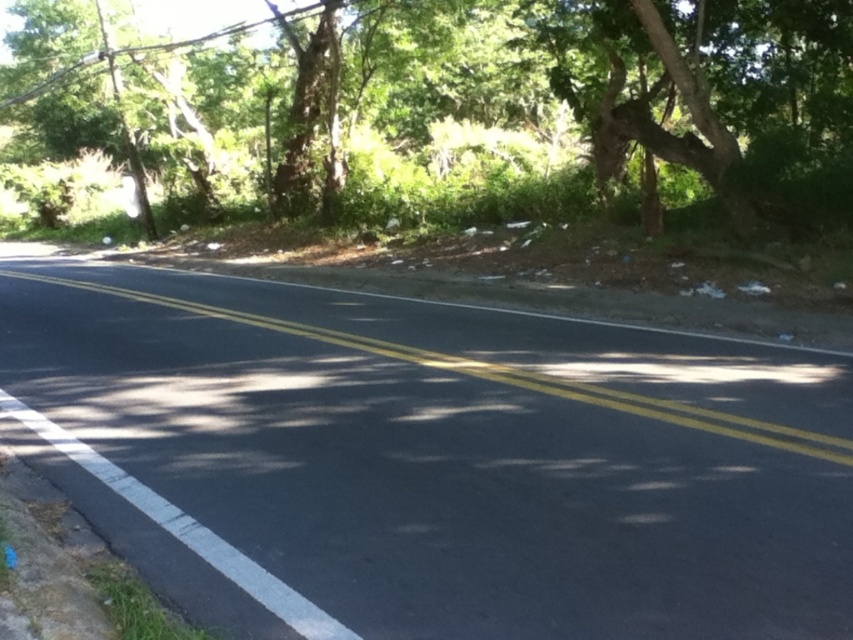
Question: Does black asphalt road at center appear over green leafy tree at upper center?

Choices:
 (A) yes
 (B) no

Answer: (B)

Question: In this image, where is black asphalt road at center located relative to green leafy tree at upper center?

Choices:
 (A) below
 (B) above

Answer: (A)

Question: In this image, where is black asphalt road at center located relative to green leafy tree at upper center?

Choices:
 (A) right
 (B) left

Answer: (A)

Question: Among these objects, which one is farthest from the camera?

Choices:
 (A) black asphalt road at center
 (B) green leafy tree at upper center

Answer: (B)

Question: Among these objects, which one is nearest to the camera?

Choices:
 (A) black asphalt road at center
 (B) green leafy tree at upper center

Answer: (A)

Question: Which point is farther to the camera?

Choices:
 (A) (775, 188)
 (B) (291, 410)

Answer: (A)